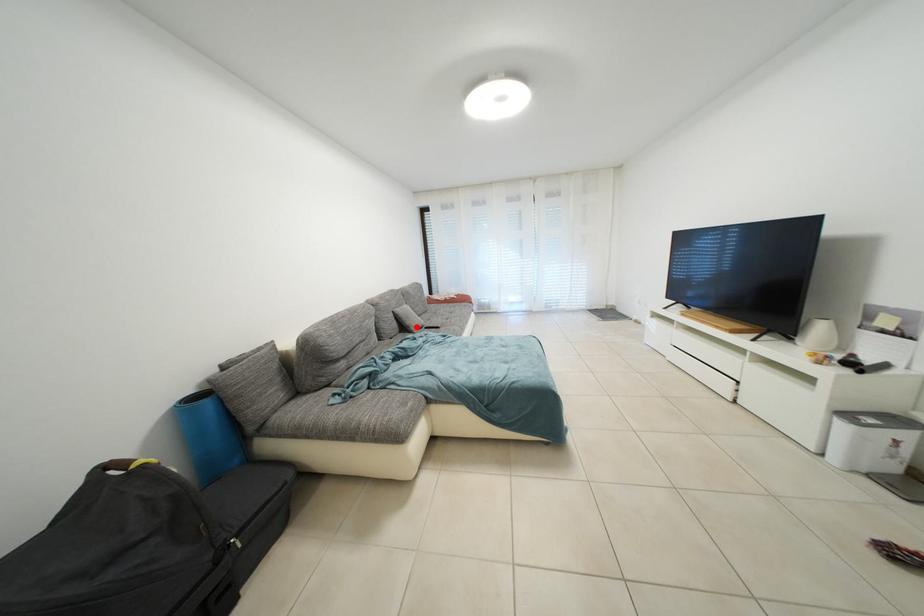
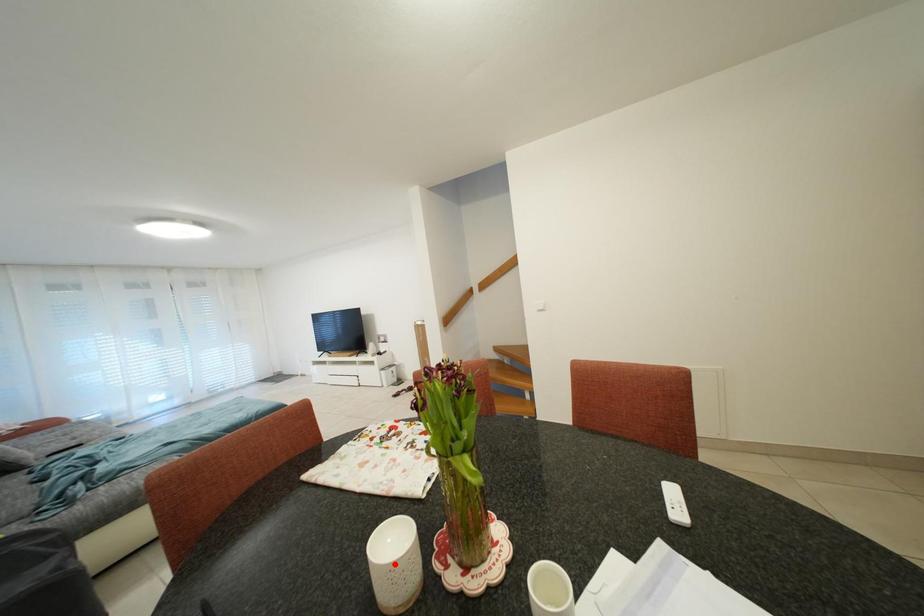
I am providing you with two images of the same scene from different viewpoints. A red point is marked on the first image and another point is marked on the second image. Do the highlighted points in image1 and image2 indicate the same real-world spot?

No